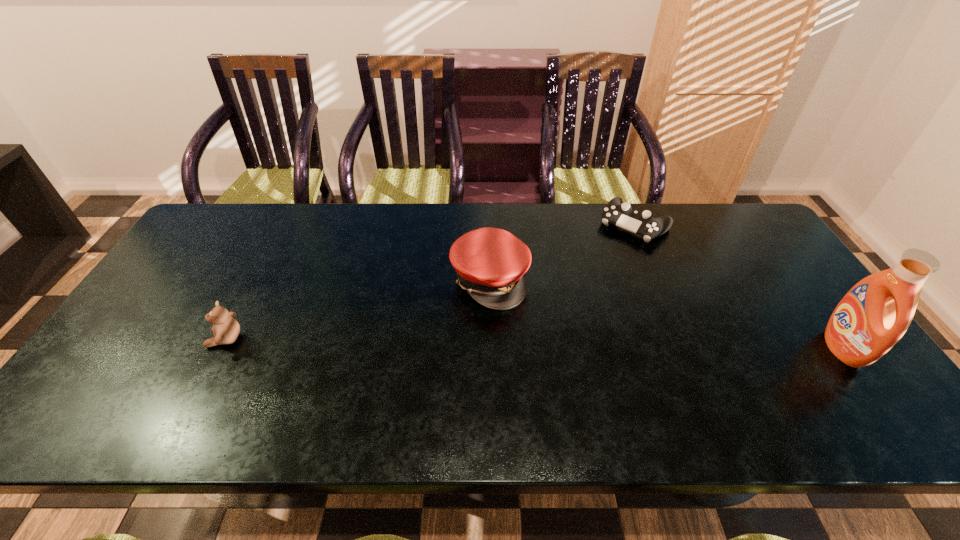
Where is `free space located 0.230m on the front-facing side of the rightmost object`? The width and height of the screenshot is (960, 540). free space located 0.230m on the front-facing side of the rightmost object is located at coordinates (736, 348).

You are a GUI agent. You are given a task and a screenshot of the screen. Output one action in this format:
    pyautogui.click(x=<x>, y=<y>)
    Task: Click on the vacant area situated on the front-facing side of the rightmost object
    
    Given the screenshot: What is the action you would take?
    pyautogui.click(x=773, y=348)

Where is `free spot located on the front-facing side of the rightmost object`? This screenshot has width=960, height=540. free spot located on the front-facing side of the rightmost object is located at coordinates (688, 348).

Find the location of a particular element. Image resolution: width=960 pixels, height=540 pixels. free spot located on the front of the second object from left to right with an emblem is located at coordinates (636, 374).

Identify the location of vacant space positioned 0.340m on the front of the second object from left to right with an emblem. (633, 371).

At what (x,y) coordinates should I click in order to perform the action: click on free point located 0.150m on the front of the second object from left to right with an emblem. Please return your answer as a coordinate pair (x, y). This screenshot has height=540, width=960. Looking at the image, I should click on (566, 329).

I want to click on vacant space located 0.160m on the surface of the farthest object, so click(x=595, y=269).

Where is `vacant area located 0.120m on the surface of the farthest object`? vacant area located 0.120m on the surface of the farthest object is located at coordinates (602, 261).

What are the coordinates of `vacant space situated on the surface of the farthest object` in the screenshot? It's located at (599, 265).

Locate an element on the screen. Image resolution: width=960 pixels, height=540 pixels. object that is at the far edge is located at coordinates (620, 214).